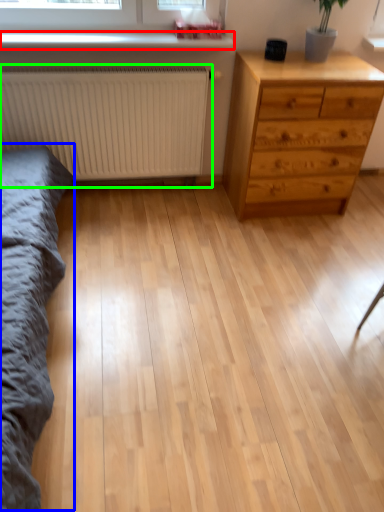
Question: Which is farther away from window sill (highlighted by a red box)? bed frame (highlighted by a blue box) or radiator (highlighted by a green box)?

Choices:
 (A) bed frame
 (B) radiator

Answer: (A)